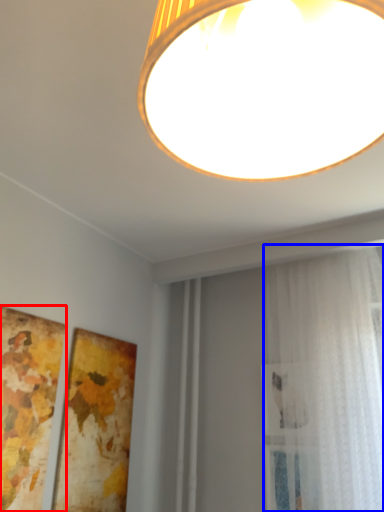
Question: Among these objects, which one is farthest to the camera, picture frame (highlighted by a red box) or curtain (highlighted by a blue box)?

Choices:
 (A) picture frame
 (B) curtain

Answer: (B)